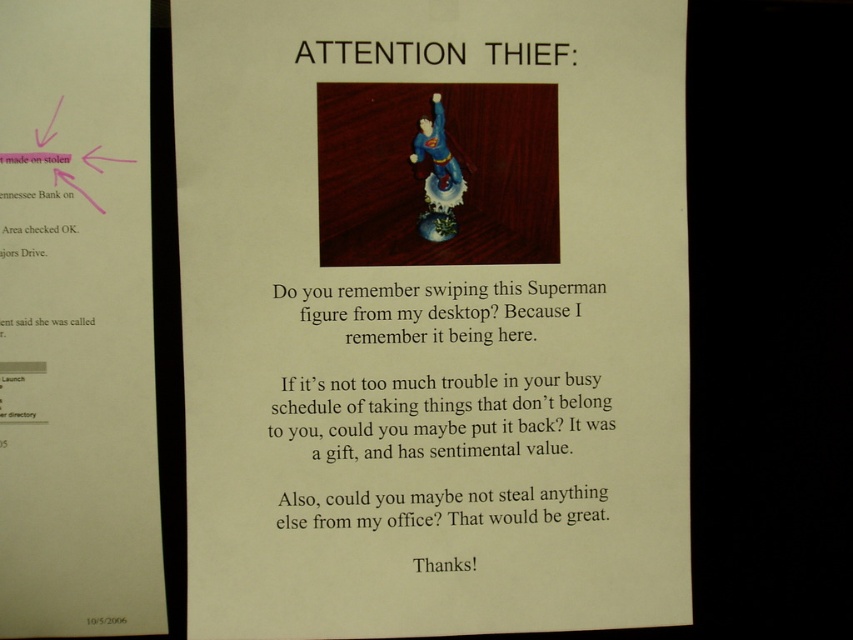
You are organizing a display in the image and need to place a new item between the porcelain superman figure at center and the matte paper poster at upper left. Based on their widths, which object should be placed on the side that requires more space?

The porcelain superman figure at center might be wider than matte paper poster at upper left, so it should be placed on the side that requires more space.

In the scene shown: Looking at the printed notice on the computer screen, which object is bigger between the matte paper poster at upper left and the matte plastic superman figure at center?

The matte paper poster at upper left is larger in size than the matte plastic superman figure at center.